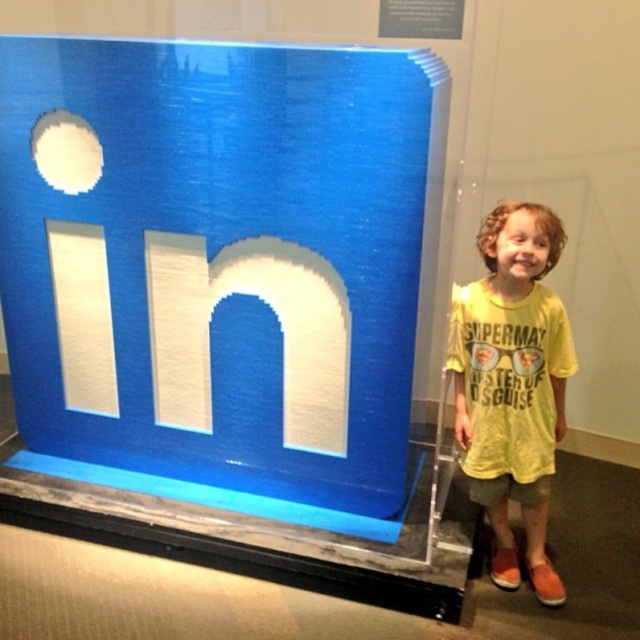
Is point (276, 304) closer to camera compared to point (106, 385)?

Yes, point (276, 304) is closer to viewer.

You are a GUI agent. You are given a task and a screenshot of the screen. Output one action in this format:
    pyautogui.click(x=<x>, y=<y>)
    Task: Click on the white brushed metal letter n at center
    
    Given the screenshot: What is the action you would take?
    pyautogui.click(x=276, y=321)

Where is `white brushed metal letter n at center`? The width and height of the screenshot is (640, 640). white brushed metal letter n at center is located at coordinates (276, 321).

Does yellow cotton shirt at right have a lesser height compared to white matte letter at center?

Incorrect, yellow cotton shirt at right's height does not fall short of white matte letter at center's.

Which of these two, yellow cotton shirt at right or white matte letter at center, stands shorter?

Standing shorter between the two is white matte letter at center.

Is point (472, 371) behind point (77, 275)?

No, (472, 371) is in front of (77, 275).

This screenshot has width=640, height=640. In order to click on yellow cotton shirt at right in this screenshot , I will do click(513, 385).

Can you confirm if yellow cotton shirt at right is wider than white brushed metal letter n at center?

No, yellow cotton shirt at right is not wider than white brushed metal letter n at center.

Does yellow cotton shirt at right appear under white brushed metal letter n at center?

Correct, yellow cotton shirt at right is located below white brushed metal letter n at center.

You are a GUI agent. You are given a task and a screenshot of the screen. Output one action in this format:
    pyautogui.click(x=<x>, y=<y>)
    Task: Click on the yellow cotton shirt at right
    
    Given the screenshot: What is the action you would take?
    pyautogui.click(x=513, y=385)

Where is `yellow cotton shirt at right`? This screenshot has height=640, width=640. yellow cotton shirt at right is located at coordinates (513, 385).